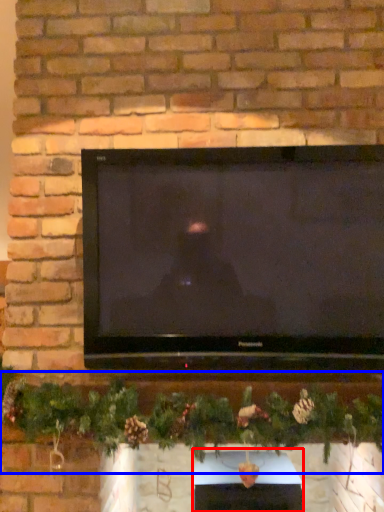
Question: Which object is further to the camera taking this photo, fireplace (highlighted by a red box) or christmas decoration (highlighted by a blue box)?

Choices:
 (A) fireplace
 (B) christmas decoration

Answer: (A)